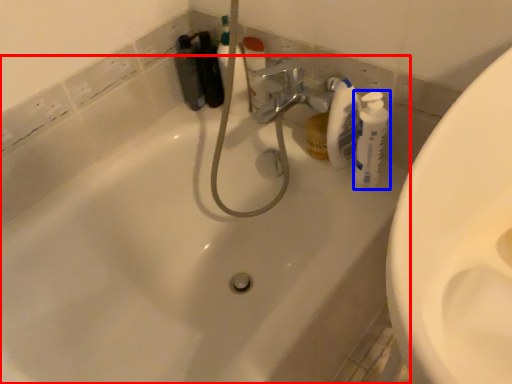
Question: Which point is further to the camera, bathtub (highlighted by a red box) or cleaning product (highlighted by a blue box)?

Choices:
 (A) bathtub
 (B) cleaning product

Answer: (B)